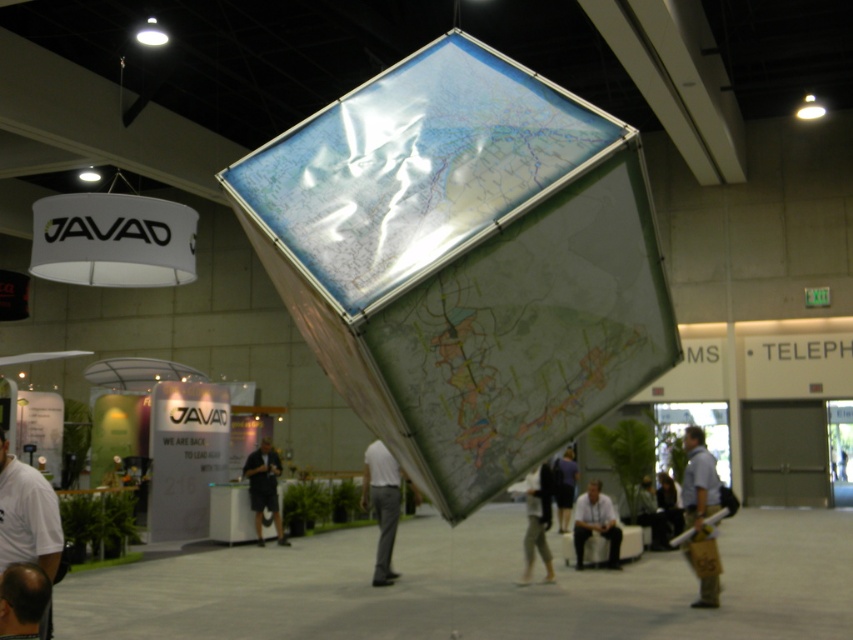
Does smooth bald head at lower left have a greater height compared to light gray shirt at lower center?

In fact, smooth bald head at lower left may be shorter than light gray shirt at lower center.

Does smooth bald head at lower left have a larger size compared to light gray shirt at lower center?

No, smooth bald head at lower left is not bigger than light gray shirt at lower center.

What are the coordinates of `smooth bald head at lower left` in the screenshot? It's located at (22, 600).

Does smooth bald head at lower left have a greater width compared to dark gray shirt at lower center?

No, smooth bald head at lower left is not wider than dark gray shirt at lower center.

I want to click on smooth bald head at lower left, so click(x=22, y=600).

Identify the location of smooth bald head at lower left. The image size is (853, 640). (22, 600).

Can you confirm if light blue shirt at lower right is positioned below light gray shirt at lower center?

No.

Does light blue shirt at lower right appear on the left side of light gray shirt at lower center?

Incorrect, light blue shirt at lower right is not on the left side of light gray shirt at lower center.

Is point (689, 465) closer to viewer compared to point (614, 548)?

Yes, it is in front of point (614, 548).

Find the location of `light blue shirt at lower right`. light blue shirt at lower right is located at coordinates (698, 480).